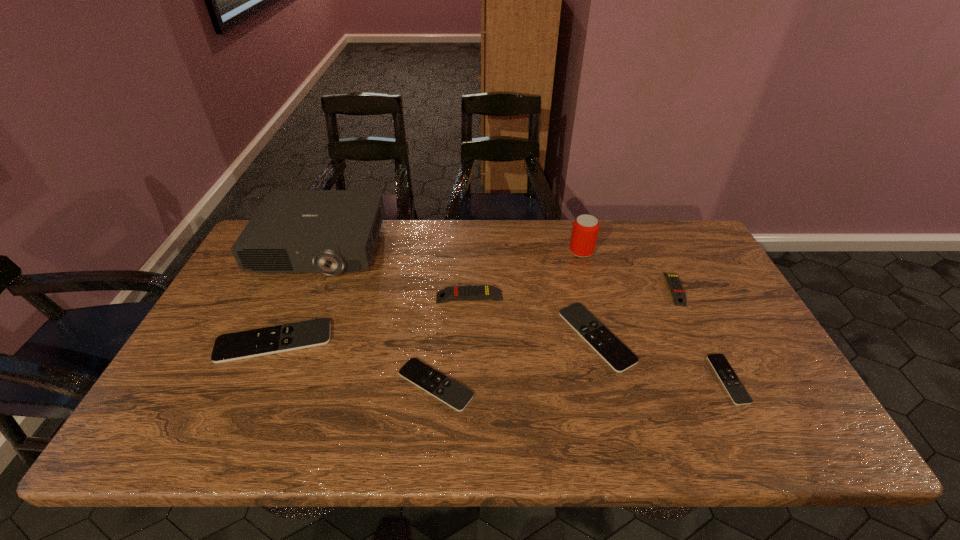
The width and height of the screenshot is (960, 540). Find the location of `the fifth tallest remote control`. the fifth tallest remote control is located at coordinates (455, 395).

You are a GUI agent. You are given a task and a screenshot of the screen. Output one action in this format:
    pyautogui.click(x=<x>, y=<y>)
    Task: Click on the third black remote control from right to left
    This screenshot has width=960, height=540.
    Given the screenshot: What is the action you would take?
    pyautogui.click(x=455, y=395)

I want to click on the rightmost black remote control, so point(735,389).

Where is `the shortest remote control`? the shortest remote control is located at coordinates (735, 389).

Image resolution: width=960 pixels, height=540 pixels. Find the location of `vacant point located 0.330m on the front-facing side of the projector`. vacant point located 0.330m on the front-facing side of the projector is located at coordinates (267, 369).

The width and height of the screenshot is (960, 540). Identify the location of free space located 0.380m on the front of the red beer can. (610, 354).

This screenshot has width=960, height=540. Find the location of `free space located on the back of the third tallest object`. free space located on the back of the third tallest object is located at coordinates [x=471, y=235].

This screenshot has width=960, height=540. I want to click on vacant region located on the front of the second tallest remote control, so click(741, 430).

Find the location of a particular element. vacant region located on the back of the third tallest remote control is located at coordinates (295, 296).

The image size is (960, 540). I want to click on vacant space located 0.240m on the back of the third shortest object, so click(x=575, y=253).